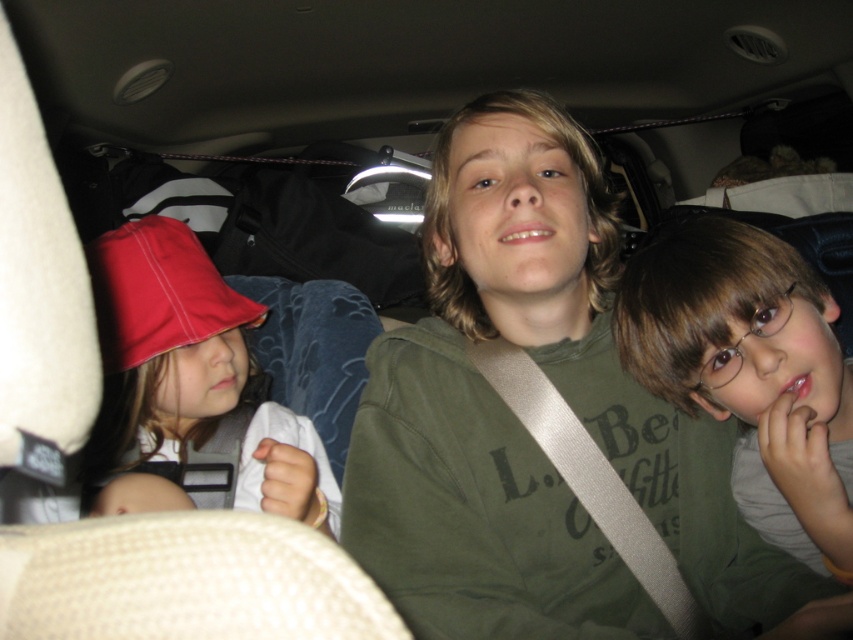
Can you confirm if matte green shirt at center is wider than matte red hat at left?

No, matte green shirt at center is not wider than matte red hat at left.

Does point (676, 253) come behind point (267, 449)?

Yes.

Find the location of a particular element. This screenshot has height=640, width=853. matte green shirt at center is located at coordinates (751, 372).